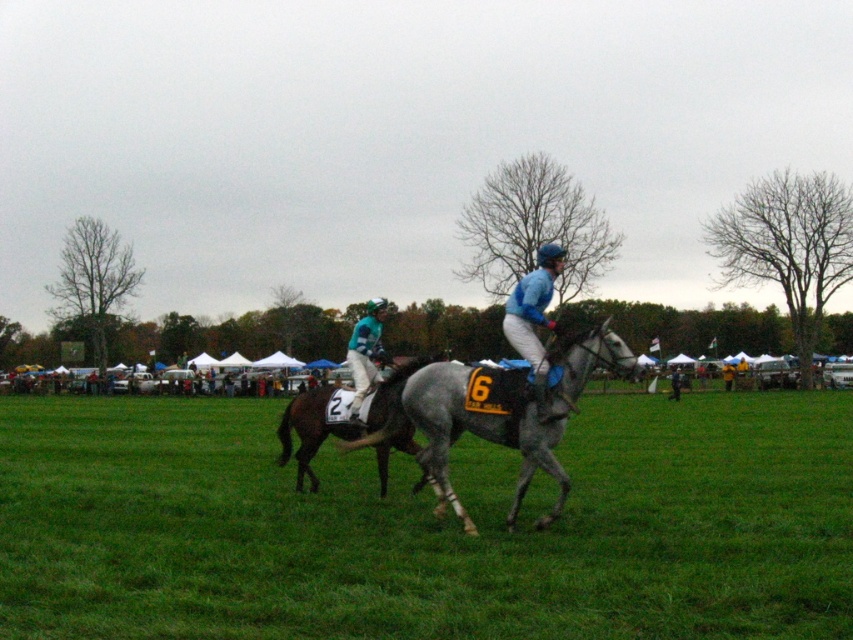
Who is more forward, (x=573, y=376) or (x=357, y=339)?

Point (x=573, y=376)

Does gray glossy horse at center have a greater height compared to teal jersey at center?

No.

Is point (444, 368) closer to camera compared to point (361, 392)?

Yes, it is.

Find the location of a particular element. gray glossy horse at center is located at coordinates (506, 413).

Who is lower down, dark brown glossy horse at center or light blue jersey at center?

dark brown glossy horse at center

Who is positioned more to the right, dark brown glossy horse at center or light blue jersey at center?

light blue jersey at center is more to the right.

Does point (402, 371) come closer to viewer compared to point (506, 301)?

Yes, point (402, 371) is closer to viewer.

Locate an element on the screen. The height and width of the screenshot is (640, 853). dark brown glossy horse at center is located at coordinates 347,422.

Is point (381, 348) positioned after point (727, 381)?

That is False.

Does teal jersey at center have a greater height compared to yellow fabric umbrella at center?

Yes, teal jersey at center is taller than yellow fabric umbrella at center.

Locate an element on the screen. The width and height of the screenshot is (853, 640). teal jersey at center is located at coordinates (364, 353).